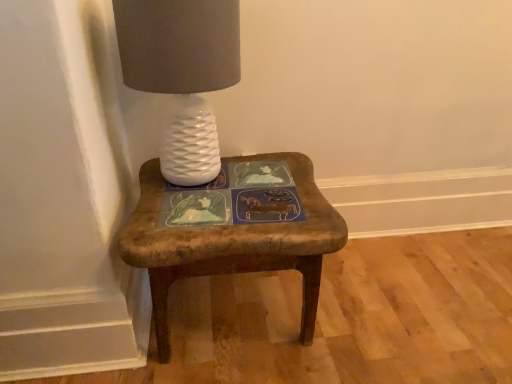
Find the location of a particular element. This screenshot has height=384, width=512. free region under white textured lamp at upper left (from a real-world perspective) is located at coordinates (184, 188).